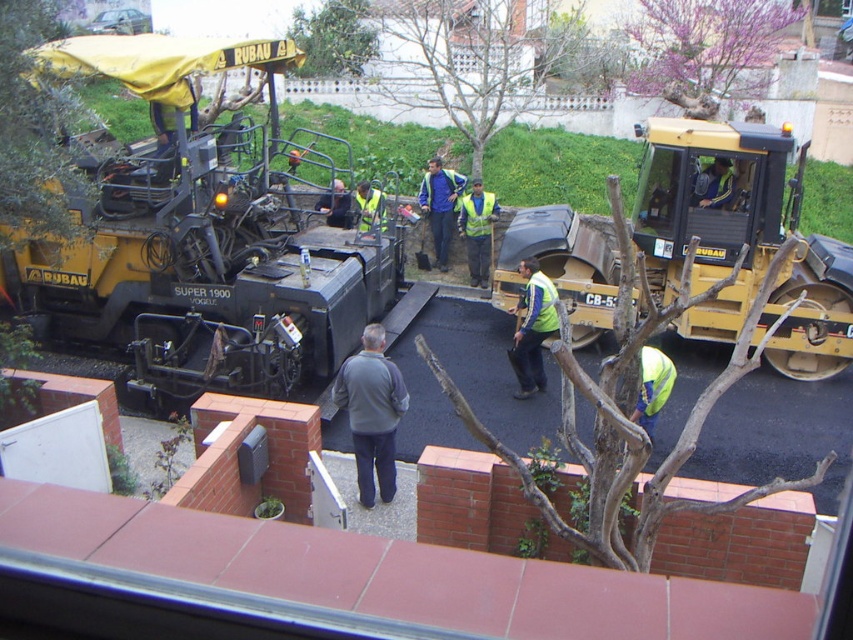
In the scene shown: Who is taller, yellow rubber tire compactor at center right or gray fleece jacket at center?

yellow rubber tire compactor at center right

Which is more to the right, yellow rubber tire compactor at center right or gray fleece jacket at center?

From the viewer's perspective, yellow rubber tire compactor at center right appears more on the right side.

What do you see at coordinates (712, 212) in the screenshot? I see `yellow rubber tire compactor at center right` at bounding box center [712, 212].

I want to click on yellow rubber tire compactor at center right, so click(712, 212).

In the scene shown: Can you confirm if gray fleece jacket at center is positioned below reflective yellow vest at center?

Indeed, gray fleece jacket at center is positioned under reflective yellow vest at center.

Identify the location of gray fleece jacket at center. Image resolution: width=853 pixels, height=640 pixels. (370, 412).

Where is `gray fleece jacket at center`? The width and height of the screenshot is (853, 640). gray fleece jacket at center is located at coordinates (370, 412).

Is yellow rubber tire compactor at center right positioned behind reflective yellow vest at center?

No.

Is point (589, 342) less distant than point (326, 211)?

That is True.

This screenshot has width=853, height=640. In order to click on yellow rubber tire compactor at center right in this screenshot , I will do `click(712, 212)`.